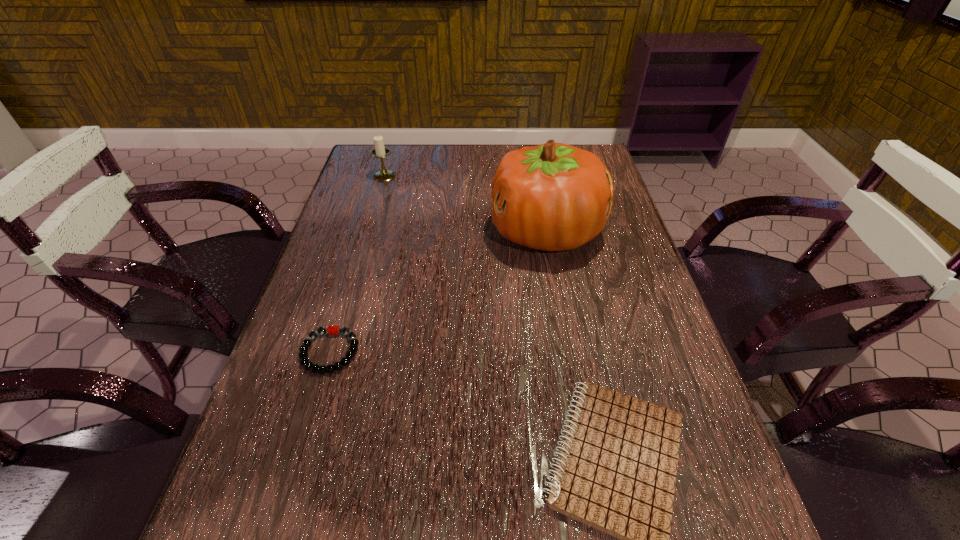
Locate an element on the screen. the tallest object is located at coordinates (553, 197).

Image resolution: width=960 pixels, height=540 pixels. I want to click on pumpkin, so click(553, 197).

Where is `candle holder`? The image size is (960, 540). candle holder is located at coordinates (380, 151).

Identify the location of the farthest object. (380, 151).

Locate an element on the screen. The width and height of the screenshot is (960, 540). bracelet is located at coordinates (303, 355).

Identify the location of the second nearest object. (303, 355).

The height and width of the screenshot is (540, 960). Find the location of `free space located on the side of the third nearest object with the cute face`. free space located on the side of the third nearest object with the cute face is located at coordinates (357, 232).

At what (x,y) coordinates should I click in order to perform the action: click on blank space located 0.210m on the side of the third nearest object with the cute face. Please return your answer as a coordinate pair (x, y). This screenshot has width=960, height=540. Looking at the image, I should click on (410, 232).

Find the location of a particular element. vacant area situated 0.120m on the side of the third nearest object with the cute face is located at coordinates (444, 232).

I want to click on blank space located 0.330m on the front of the candle holder, so click(x=362, y=254).